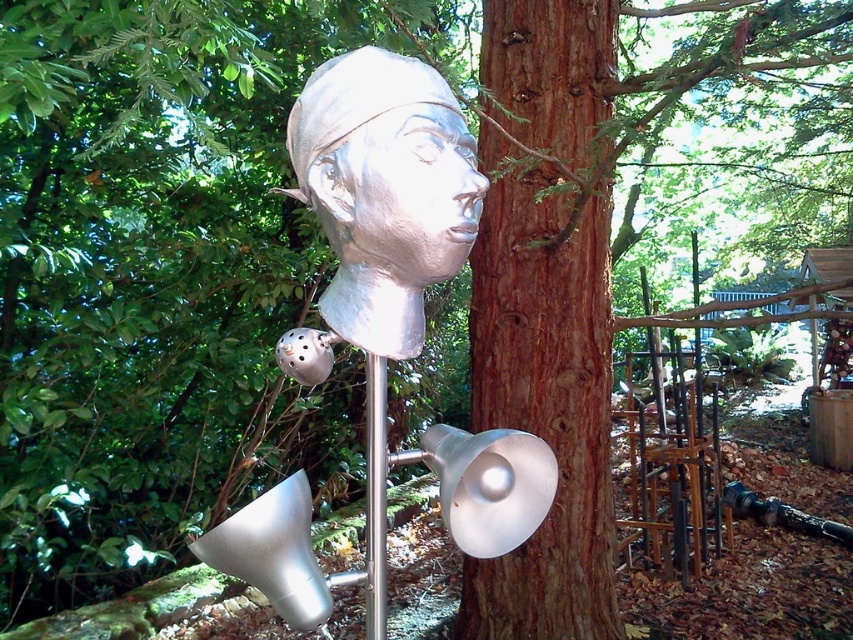
Question: Estimate the real-world distances between objects in this image. Which object is closer to the satin silver sculpture at center?

Choices:
 (A) silver metallic pole at center
 (B) brown rough bark at center

Answer: (A)

Question: Which point is farther from the camera taking this photo?

Choices:
 (A) (473, 577)
 (B) (370, 605)

Answer: (A)

Question: Is satin silver head at center thinner than silver metallic pole at center?

Choices:
 (A) yes
 (B) no

Answer: (B)

Question: Can you confirm if brown rough bark at center is positioned to the left of satin silver sculpture at center?

Choices:
 (A) yes
 (B) no

Answer: (B)

Question: Can you confirm if brown rough bark at center is positioned to the right of satin silver sculpture at center?

Choices:
 (A) no
 (B) yes

Answer: (B)

Question: Which object is positioned farthest from the brown rough bark at center?

Choices:
 (A) satin silver head at center
 (B) satin silver sculpture at center
 (C) silver metallic pole at center

Answer: (C)